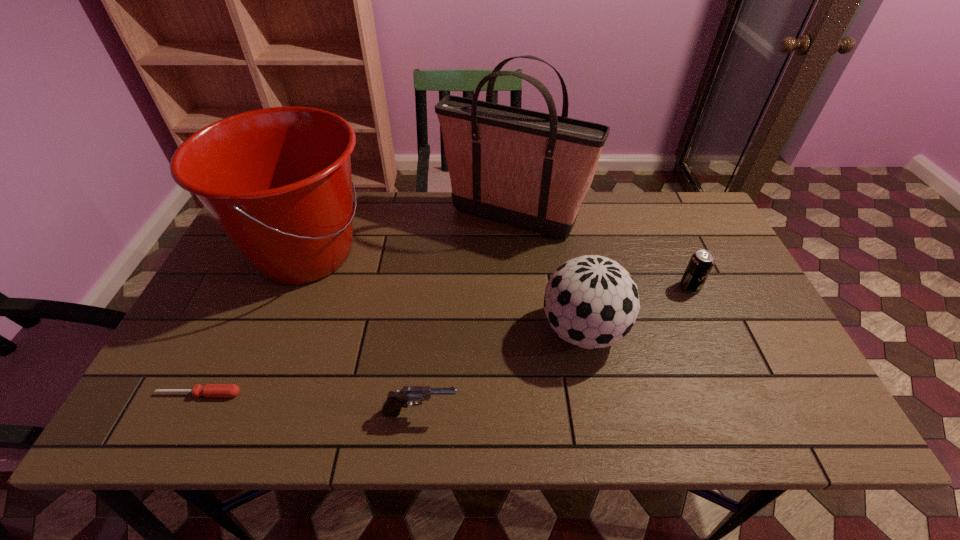
Find the location of a particular element. This screenshot has width=960, height=540. vacant position located 0.270m on the front of the rightmost object is located at coordinates (733, 385).

At what (x,y) coordinates should I click in order to perform the action: click on vacant area located 0.140m at the barrel of the pistol. Please return your answer as a coordinate pair (x, y). Looking at the image, I should click on (523, 413).

At what (x,y) coordinates should I click in order to perform the action: click on vacant space located on the back of the screwdriver. Please return your answer as a coordinate pair (x, y). Looking at the image, I should click on (260, 271).

You are a GUI agent. You are given a task and a screenshot of the screen. Output one action in this format:
    pyautogui.click(x=<x>, y=<y>)
    Task: Click on the shopping bag located in the far edge section of the desktop
    Image resolution: width=960 pixels, height=540 pixels.
    Given the screenshot: What is the action you would take?
    pyautogui.click(x=532, y=170)

You are a GUI agent. You are given a task and a screenshot of the screen. Output one action in this format:
    pyautogui.click(x=<x>, y=<y>)
    Task: Click on the bucket that is at the far edge
    
    Given the screenshot: What is the action you would take?
    pyautogui.click(x=278, y=182)

This screenshot has width=960, height=540. I want to click on pistol that is at the near edge, so click(x=395, y=401).

This screenshot has height=540, width=960. I want to click on screwdriver at the near edge, so click(x=210, y=390).

Where is `bucket that is at the left edge`? This screenshot has width=960, height=540. bucket that is at the left edge is located at coordinates pyautogui.click(x=278, y=182).

Identify the location of screwdriver that is at the left edge. Image resolution: width=960 pixels, height=540 pixels. (210, 390).

What are the coordinates of `object at the right edge` in the screenshot? It's located at (701, 263).